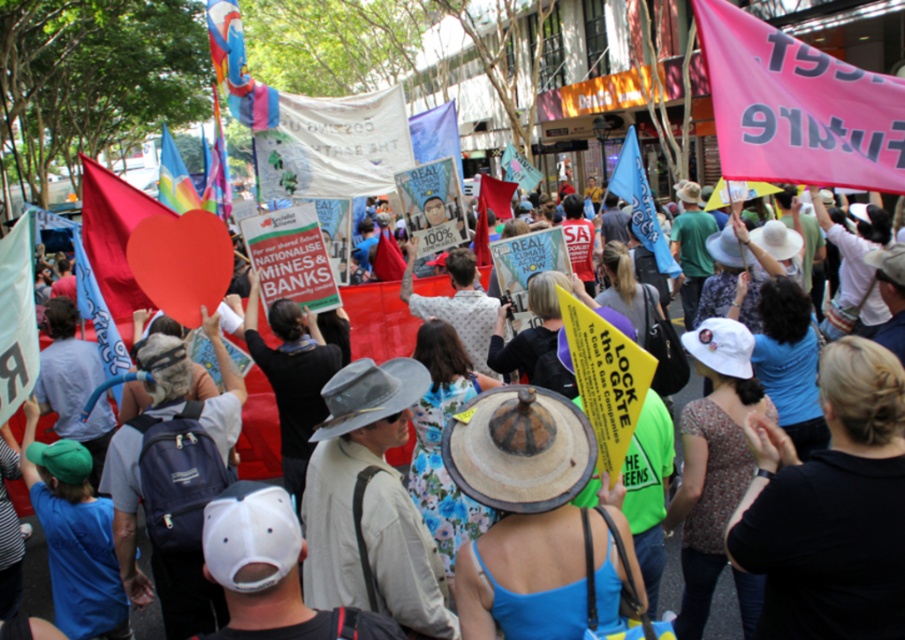
Question: Can you confirm if pink fabric banner at upper right is positioned to the right of blue fabric flag at center?

Choices:
 (A) no
 (B) yes

Answer: (A)

Question: Which of these objects is positioned farthest from the rainbow fabric flag at upper left?

Choices:
 (A) blue fabric flag at center
 (B) pink fabric banner at upper right
 (C) yellow paper sign at center

Answer: (B)

Question: Is pink fabric banner at upper right wider than yellow paper sign at center?

Choices:
 (A) no
 (B) yes

Answer: (B)

Question: Which object is positioned closest to the rainbow fabric flag at upper left?

Choices:
 (A) pink fabric banner at upper right
 (B) blue fabric flag at center
 (C) yellow paper sign at center
 (D) pink fabric banner at center

Answer: (C)

Question: Is blue fabric flag at center bigger than rainbow fabric flag at upper left?

Choices:
 (A) yes
 (B) no

Answer: (B)

Question: Among these objects, which one is nearest to the camera?

Choices:
 (A) pink fabric banner at center
 (B) pink fabric banner at upper right
 (C) rainbow fabric flag at upper left
 (D) blue fabric flag at center

Answer: (B)